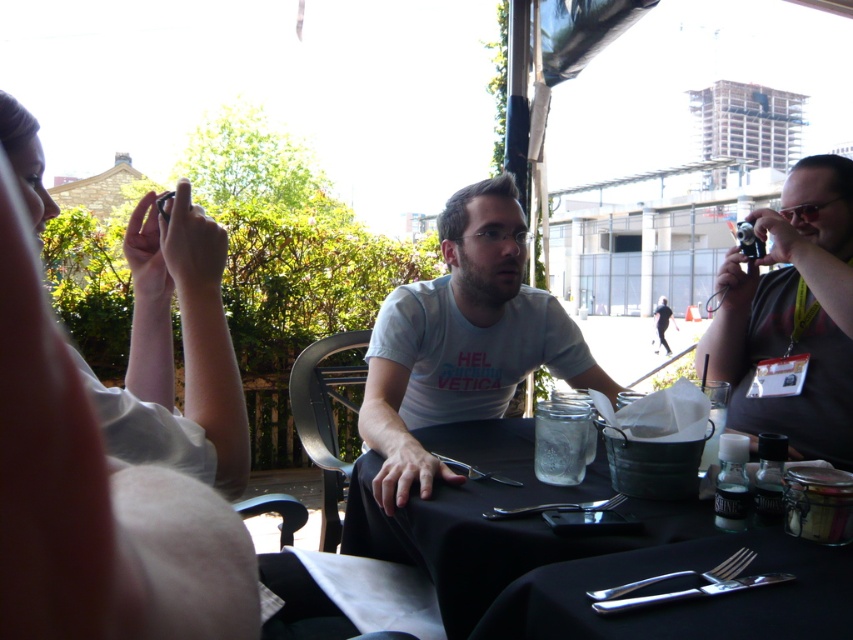
You are a photographer trying to capture a clear shot of the white cotton shirt at center without the matte black camera at right blocking the view. Based on their relative heights, can you position yourself lower to avoid the camera obstructing the shirt?

The white cotton shirt at center is much taller than the matte black camera at right, so positioning yourself lower might still allow you to see the shirt above the camera.

You are a photographer trying to capture the black matte table at center and the matte black camera at right in a single shot. Based on their positions, which object should you position closer to the left side of your camera frame?

The black matte table at center should be positioned closer to the left side of your camera frame since it is located to the left of the matte black camera at right.